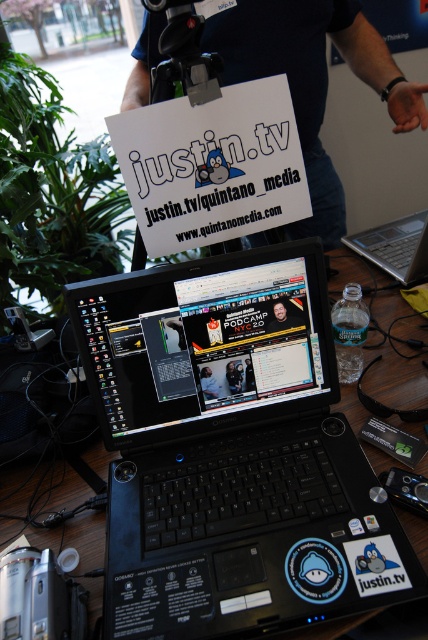
Question: Can you confirm if white paper sign at center is positioned to the left of silver metallic laptop at center?

Choices:
 (A) no
 (B) yes

Answer: (B)

Question: Which object appears closest to the camera in this image?

Choices:
 (A) blue shirt at upper center
 (B) white paper sign at center
 (C) silver metallic laptop at center
 (D) black plastic video camera at lower left

Answer: (D)

Question: Is blue shirt at upper center thinner than silver metallic laptop at center?

Choices:
 (A) yes
 (B) no

Answer: (B)

Question: Which object is positioned closest to the black plastic laptop at center?

Choices:
 (A) white paper sign at center
 (B) blue shirt at upper center

Answer: (A)

Question: Can you confirm if white paper sign at center is bigger than silver metallic laptop at center?

Choices:
 (A) yes
 (B) no

Answer: (B)

Question: Which point is farther from the camera taking this photo?

Choices:
 (A) (130, 275)
 (B) (410, 256)
 (C) (8, 570)
 (D) (284, 19)

Answer: (B)